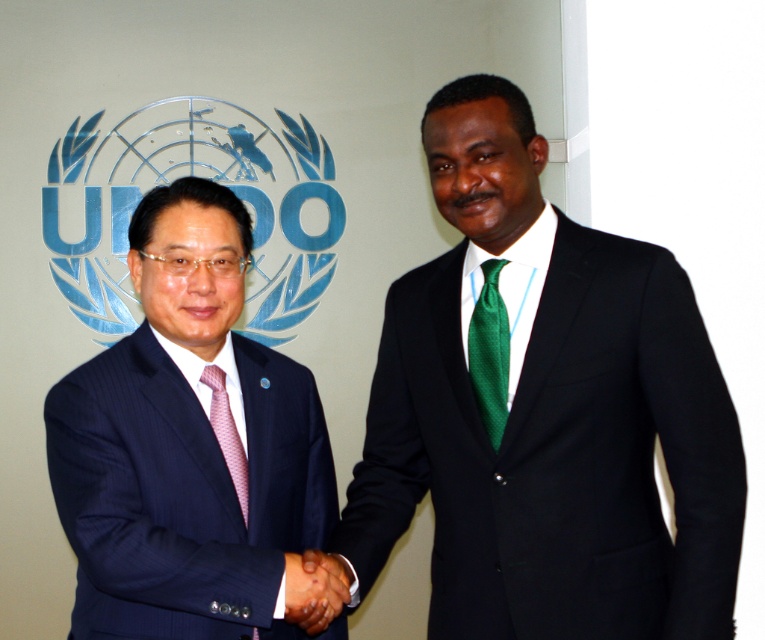
Is shiny black suit at center positioned before matte black suit at left?

Yes, shiny black suit at center is in front of matte black suit at left.

You are a GUI agent. You are given a task and a screenshot of the screen. Output one action in this format:
    pyautogui.click(x=<x>, y=<y>)
    Task: Click on the shiny black suit at center
    This screenshot has height=640, width=765.
    Given the screenshot: What is the action you would take?
    pyautogui.click(x=549, y=419)

Between matte black suit at left and pink dotted tie at left, which one has more height?

With more height is matte black suit at left.

Which is above, matte black suit at left or pink dotted tie at left?

matte black suit at left

At what (x,y) coordinates should I click in order to perform the action: click on matte black suit at left. Please return your answer as a coordinate pair (x, y). Looking at the image, I should click on (187, 444).

Is shiny black suit at center shorter than pink dotted tie at left?

Incorrect, shiny black suit at center's height does not fall short of pink dotted tie at left's.

Consider the image. Can you confirm if shiny black suit at center is smaller than pink dotted tie at left?

Actually, shiny black suit at center might be larger than pink dotted tie at left.

Which is behind, point (610, 576) or point (246, 502)?

Point (246, 502)

This screenshot has height=640, width=765. In order to click on shiny black suit at center in this screenshot , I will do `click(549, 419)`.